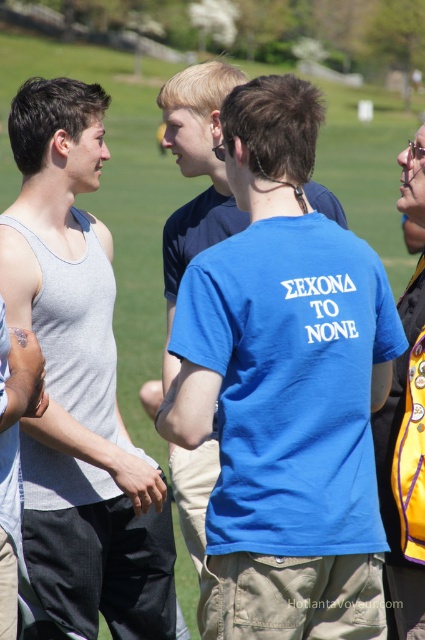
Question: Is gray matte tank top at left to the right of yellow fabric backpack at right from the viewer's perspective?

Choices:
 (A) no
 (B) yes

Answer: (A)

Question: Which point is farther to the camera?

Choices:
 (A) yellow fabric backpack at right
 (B) gray matte tank top at left

Answer: (B)

Question: Is gray matte tank top at left positioned behind yellow fabric backpack at right?

Choices:
 (A) no
 (B) yes

Answer: (B)

Question: Which point is farther to the camera?

Choices:
 (A) gray matte tank top at left
 (B) yellow fabric backpack at right

Answer: (A)

Question: In this image, where is gray matte tank top at left located relative to yellow fabric backpack at right?

Choices:
 (A) above
 (B) below

Answer: (B)

Question: Which point is farther to the camera?

Choices:
 (A) (87, 342)
 (B) (419, 356)

Answer: (A)